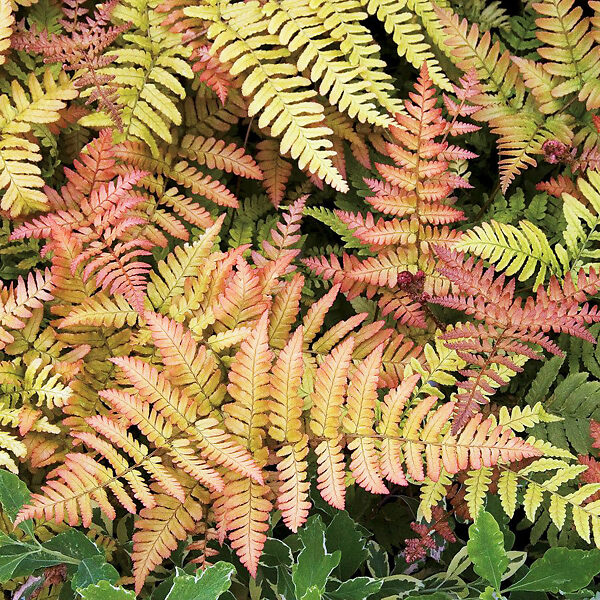
Locate an element on the screen. This screenshot has height=600, width=600. green plants is located at coordinates (574, 409), (511, 210), (324, 220), (239, 234), (252, 216), (522, 31), (484, 18).